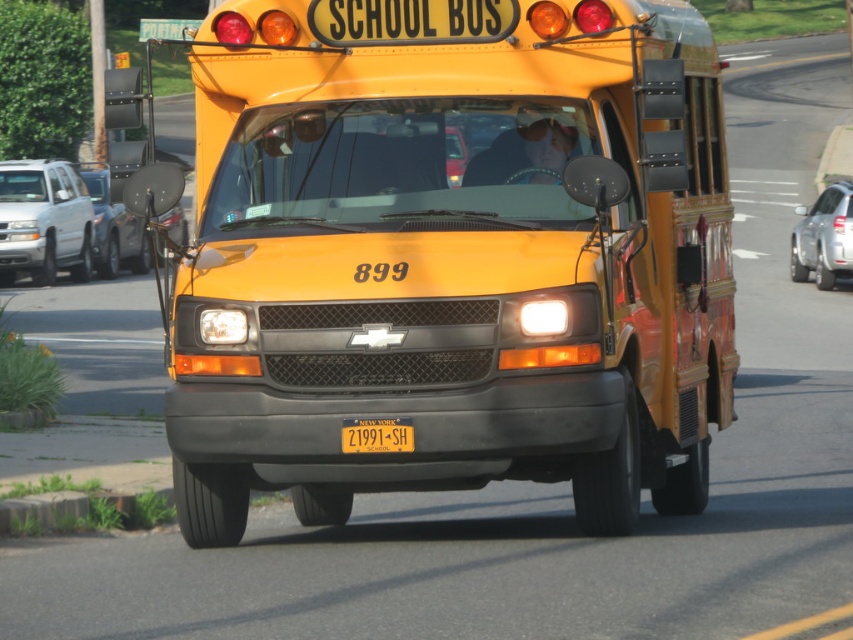
Question: Does yellow matte school bus at center appear under yellow matte license plate at center?

Choices:
 (A) no
 (B) yes

Answer: (A)

Question: Among these objects, which one is farthest from the camera?

Choices:
 (A) yellow matte license plate at center
 (B) yellow matte school bus at center

Answer: (B)

Question: Estimate the real-world distances between objects in this image. Which object is closer to the white matte suv at left?

Choices:
 (A) metallic silver car at left
 (B) yellow matte school bus at center
 (C) yellow matte license plate at center
 (D) satin silver car at right

Answer: (A)

Question: Can you confirm if white matte suv at left is positioned above satin silver car at right?

Choices:
 (A) yes
 (B) no

Answer: (A)

Question: Is the position of satin silver car at right less distant than that of metallic silver car at left?

Choices:
 (A) yes
 (B) no

Answer: (B)

Question: Which point appears closest to the camera in this image?

Choices:
 (A) (364, 422)
 (B) (28, 224)
 (C) (819, 218)

Answer: (A)